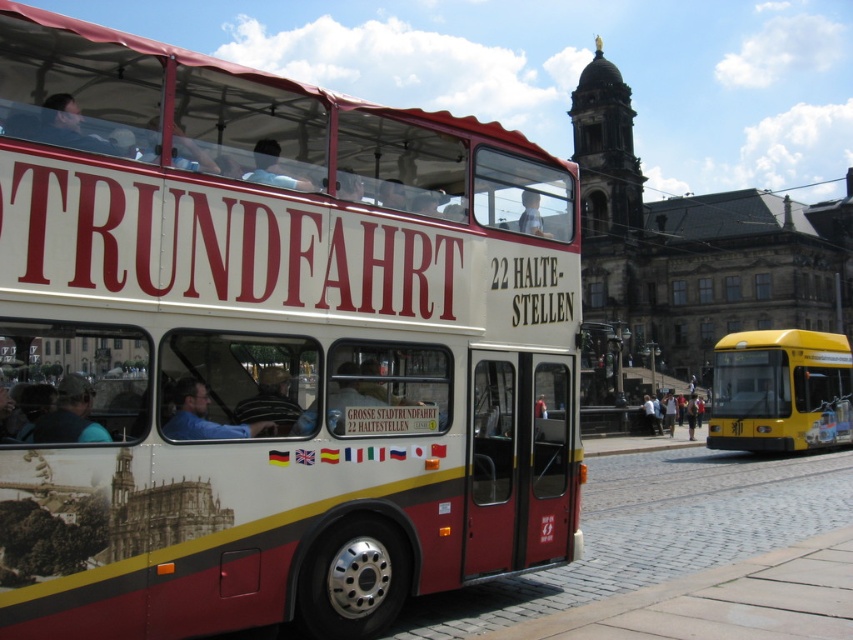
From the picture: You are a tour guide standing at the starting point of the tour. You need to direct your passengers to board the yellow matte bus at lower right. Since you can only see the bus from your current position, can you tell them where exactly the bus is located in the image using coordinates?

The yellow matte bus at lower right is located at coordinates point (780, 390).

You are a passenger on the yellow matte bus at lower right and want to ask the driver, who is wearing a blue shirt at driver left, a question. Can you see the driver from your current position?

The blue shirt at driver left is behind the yellow matte bus at lower right, so the driver is not visible from your current position on the bus.